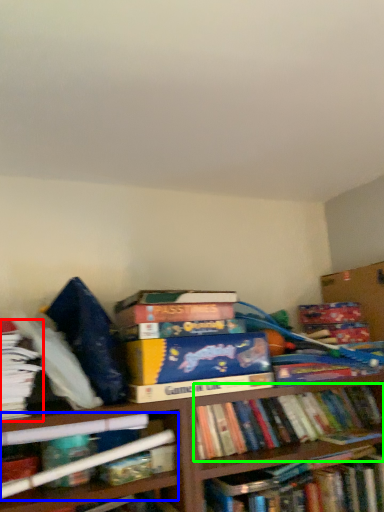
Question: Which is nearer to the book (highlighted by a red box)? book (highlighted by a blue box) or book (highlighted by a green box).

Choices:
 (A) book
 (B) book

Answer: (A)